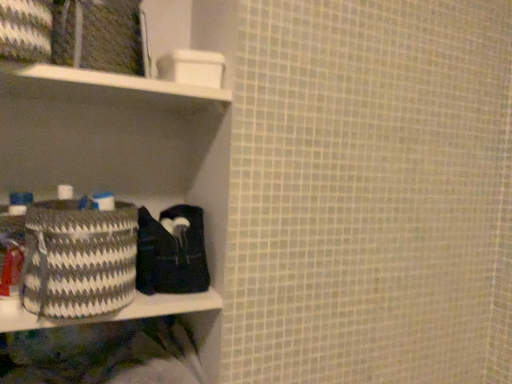
Question: Does white plastic shelf at upper left lie behind white and gray woven basket at left?

Choices:
 (A) yes
 (B) no

Answer: (A)

Question: Does white plastic shelf at upper left have a lesser height compared to white and gray woven basket at left?

Choices:
 (A) no
 (B) yes

Answer: (B)

Question: From the image's perspective, is white plastic shelf at upper left under white and gray woven basket at left?

Choices:
 (A) yes
 (B) no

Answer: (B)

Question: Is white plastic shelf at upper left thinner than white and gray woven basket at left?

Choices:
 (A) yes
 (B) no

Answer: (B)

Question: Considering the relative sizes of white plastic shelf at upper left and white and gray woven basket at left in the image provided, is white plastic shelf at upper left wider than white and gray woven basket at left?

Choices:
 (A) no
 (B) yes

Answer: (B)

Question: From the image's perspective, does white plastic shelf at upper left appear higher than white and gray woven basket at left?

Choices:
 (A) yes
 (B) no

Answer: (A)

Question: Is white plastic shelf at upper left positioned behind black fabric at lower left?

Choices:
 (A) no
 (B) yes

Answer: (A)

Question: Does white plastic shelf at upper left lie in front of black fabric at lower left?

Choices:
 (A) yes
 (B) no

Answer: (A)

Question: Is white plastic shelf at upper left thinner than black fabric at lower left?

Choices:
 (A) yes
 (B) no

Answer: (B)

Question: Can you confirm if white plastic shelf at upper left is wider than black fabric at lower left?

Choices:
 (A) yes
 (B) no

Answer: (A)

Question: From the image's perspective, is white plastic shelf at upper left located above black fabric at lower left?

Choices:
 (A) yes
 (B) no

Answer: (A)

Question: Could you tell me if white plastic shelf at upper left is turned towards black fabric at lower left?

Choices:
 (A) no
 (B) yes

Answer: (A)

Question: Does textured woven basket at lower left lie behind white and gray woven basket at left?

Choices:
 (A) no
 (B) yes

Answer: (B)